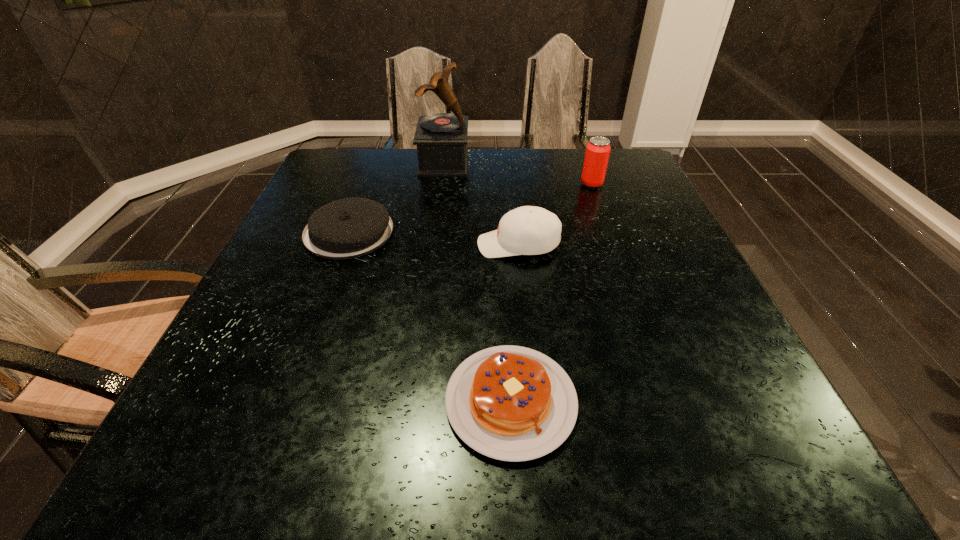
You are a GUI agent. You are given a task and a screenshot of the screen. Output one action in this format:
    pyautogui.click(x=<x>, y=<y>)
    Task: Click on the object that is at the right edge
    
    Given the screenshot: What is the action you would take?
    pyautogui.click(x=598, y=149)

Identify the location of object situated at the far right corner. (598, 149).

This screenshot has width=960, height=540. Identify the location of free space at the far edge of the desktop. (515, 180).

This screenshot has height=540, width=960. What are the coordinates of `vacant area at the left edge of the desktop` in the screenshot? It's located at (321, 293).

I want to click on free space at the right edge of the desktop, so click(x=712, y=355).

Where is `vacant space at the far left corner of the desktop`? The height and width of the screenshot is (540, 960). vacant space at the far left corner of the desktop is located at coordinates (360, 158).

In the image, there is a desktop. Where is `vacant space at the far right corner`? This screenshot has height=540, width=960. vacant space at the far right corner is located at coordinates (623, 183).

This screenshot has width=960, height=540. I want to click on free spot between the fourth nearest object and the phonograph_record, so (517, 173).

At what (x,y) coordinates should I click in order to perform the action: click on empty space between the second shortest object and the farthest object. Please return your answer as a coordinate pair (x, y). Image resolution: width=960 pixels, height=540 pixels. Looking at the image, I should click on (396, 197).

Identify the location of vacant area that lies between the left pancake and the second farthest object. (470, 208).